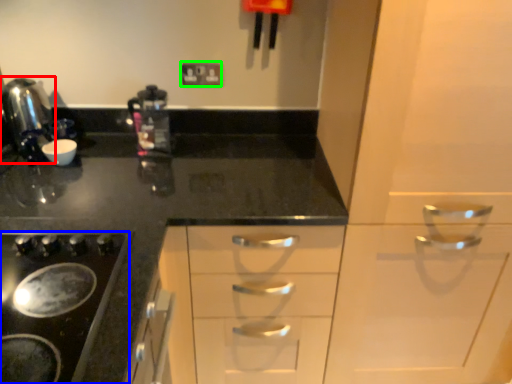
Question: Which object is positioned farthest from kitchen appliance (highlighted by a red box)? Select from gas stove (highlighted by a blue box) and electric outlet (highlighted by a green box).

Choices:
 (A) gas stove
 (B) electric outlet

Answer: (A)